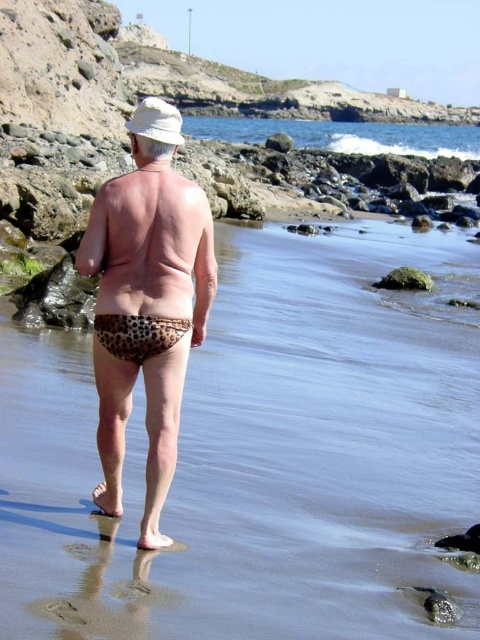
Does leopard print swimwear at center appear over leopard print fabric at lower center?

Yes.

Based on the photo, between leopard print swimwear at center and leopard print fabric at lower center, which one appears on the right side from the viewer's perspective?

leopard print fabric at lower center is more to the right.

Between point (132, 198) and point (144, 323), which one is positioned behind?

The point (132, 198) is more distant.

I want to click on leopard print swimwear at center, so click(146, 304).

Is point (324, 132) positioned after point (110, 339)?

That is True.

Can you confirm if blue water at upper center is smaller than leopard print fabric at lower center?

No, blue water at upper center is not smaller than leopard print fabric at lower center.

Is point (211, 138) positioned after point (151, 324)?

That is True.

In order to click on blue water at upper center in this screenshot , I will do `click(345, 134)`.

Between leopard print swimwear at center and blue water at upper center, which one is positioned lower?

leopard print swimwear at center is lower down.

Between point (151, 202) and point (315, 147), which one is positioned in front?

Point (151, 202) is more forward.

At what (x,y) coordinates should I click in order to perform the action: click on leopard print swimwear at center. Please return your answer as a coordinate pair (x, y). This screenshot has height=640, width=480. Looking at the image, I should click on (146, 304).